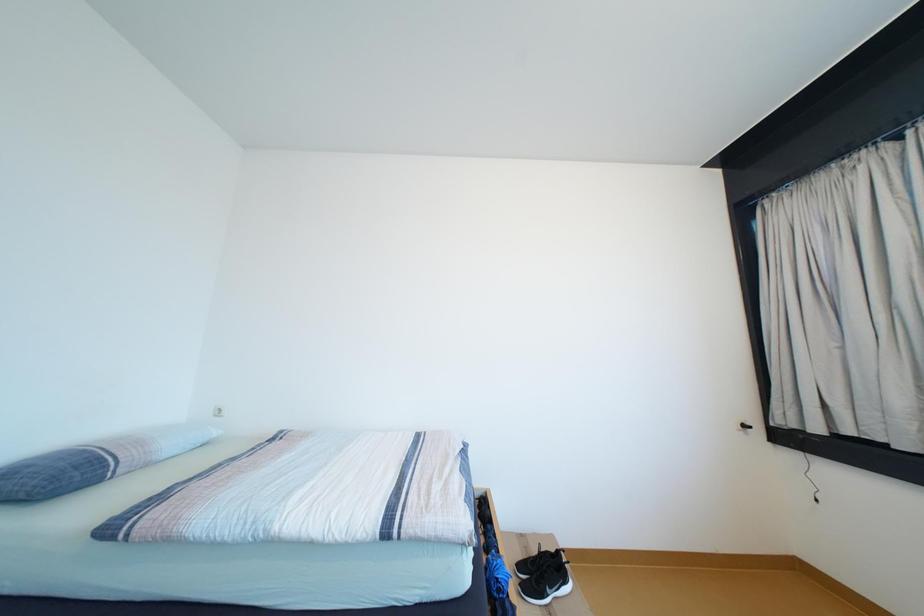
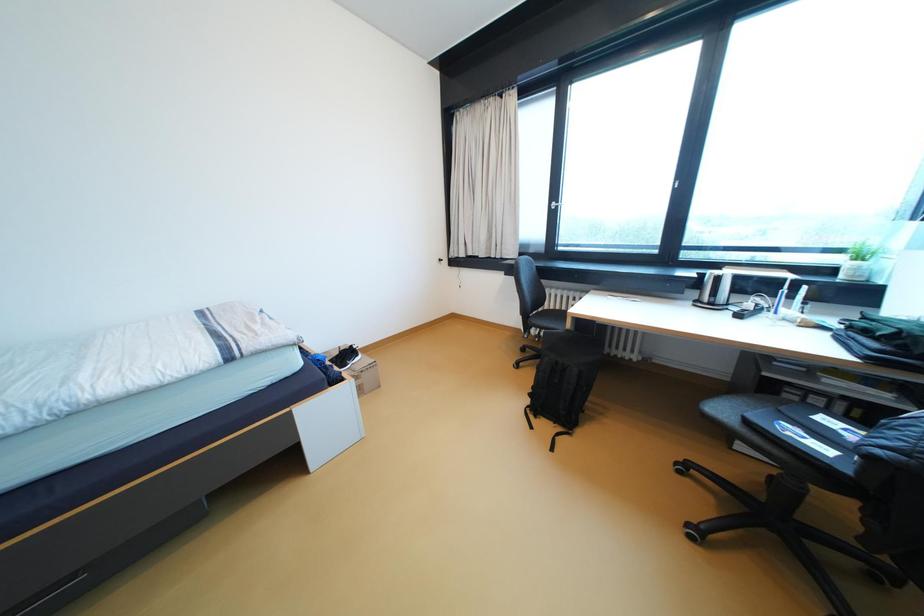
First-person continuous shooting, in which direction is the camera rotating?

The camera rotated toward right-down.